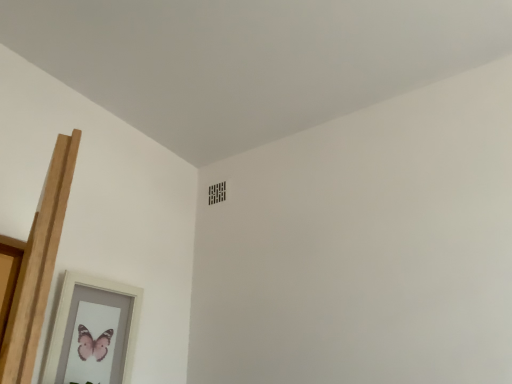
Find the location of a particular element. The height and width of the screenshot is (384, 512). matte white picture frame at lower left is located at coordinates (x=68, y=314).

Describe the element at coordinates (68, 314) in the screenshot. This screenshot has width=512, height=384. I see `matte white picture frame at lower left` at that location.

Locate an element on the screen. This screenshot has height=384, width=512. matte white picture frame at lower left is located at coordinates (68, 314).